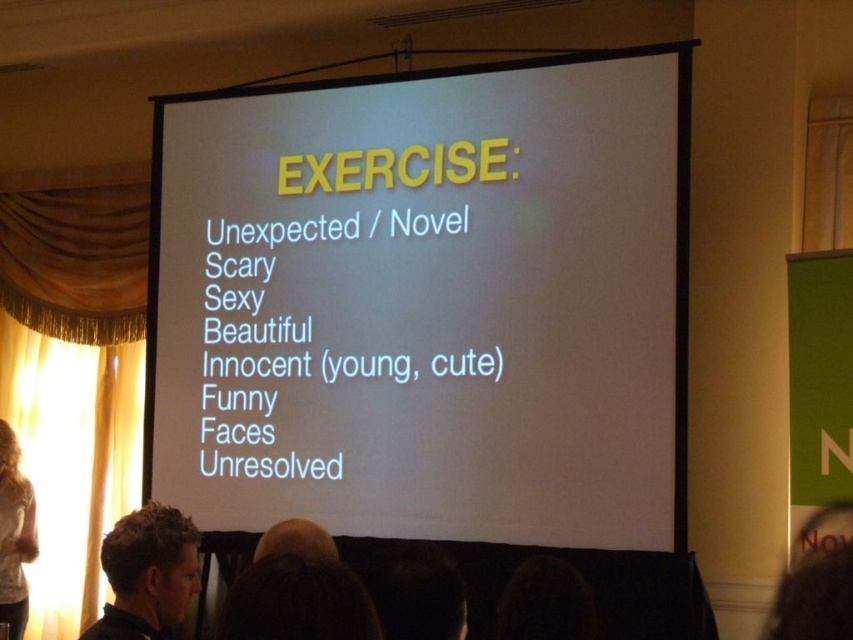
You are an event planner setting up for a presentation. You need to ensure that the white matte projection screen at center is visible to all attendees. Considering the light brown hair at left of a front row attendee might block the view, which object should you prioritize adjusting to maintain visibility?

The white matte projection screen at center should be prioritized since its width is larger than the light brown hair at left, making it the primary focus. Adjusting the screen position or angle might help ensure it remains visible despite the hair obstruction.

You are a presenter standing at the front of the room. You want to ensure all audience members can see the white matte projection screen at center clearly. Based on your position, where should you stand to avoid casting a shadow on the screen?

You should stand to the side of the white matte projection screen at center to avoid casting a shadow on it.